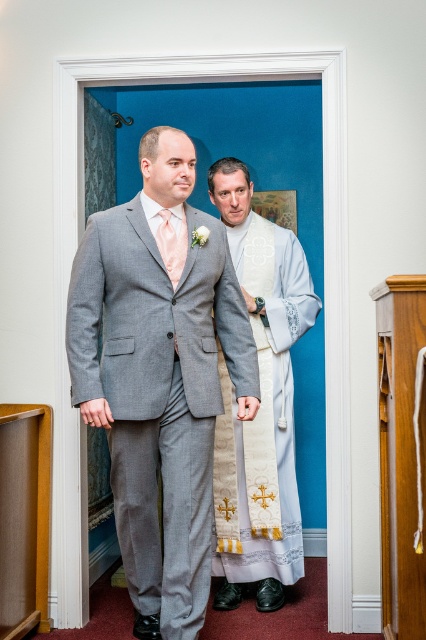
Can you confirm if white lace dress at right is bigger than peach satin tie at center?

Yes, white lace dress at right is bigger than peach satin tie at center.

Describe the element at coordinates (262, 417) in the screenshot. I see `white lace dress at right` at that location.

At what (x,y) coordinates should I click in order to perform the action: click on white lace dress at right. Please return your answer as a coordinate pair (x, y). Image resolution: width=426 pixels, height=640 pixels. Looking at the image, I should click on (262, 417).

Is gray wool suit at center taller than white lace dress at right?

Correct, gray wool suit at center is much taller as white lace dress at right.

Is point (115, 312) positioned behind point (236, 531)?

No, (115, 312) is in front of (236, 531).

Is point (123, 518) positioned in front of point (273, 552)?

Yes, point (123, 518) is closer to viewer.

You are a GUI agent. You are given a task and a screenshot of the screen. Output one action in this format:
    pyautogui.click(x=<x>, y=<y>)
    Task: Click on the gray wool suit at center
    This screenshot has height=640, width=426.
    Given the screenshot: What is the action you would take?
    pyautogui.click(x=190, y=385)

In the scene shown: Who is shorter, gray wool suit at center or peach satin tie at center?

peach satin tie at center

Does point (270, 529) come closer to viewer compared to point (164, 243)?

No, it is not.

Describe the element at coordinates (190, 385) in the screenshot. Image resolution: width=426 pixels, height=640 pixels. I see `gray wool suit at center` at that location.

The width and height of the screenshot is (426, 640). What are the coordinates of `gray wool suit at center` in the screenshot? It's located at (190, 385).